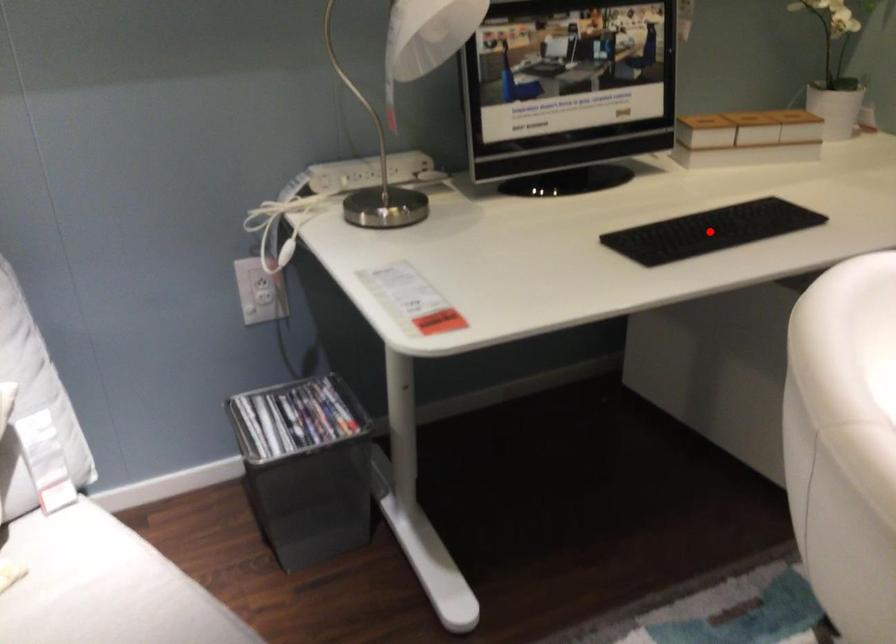
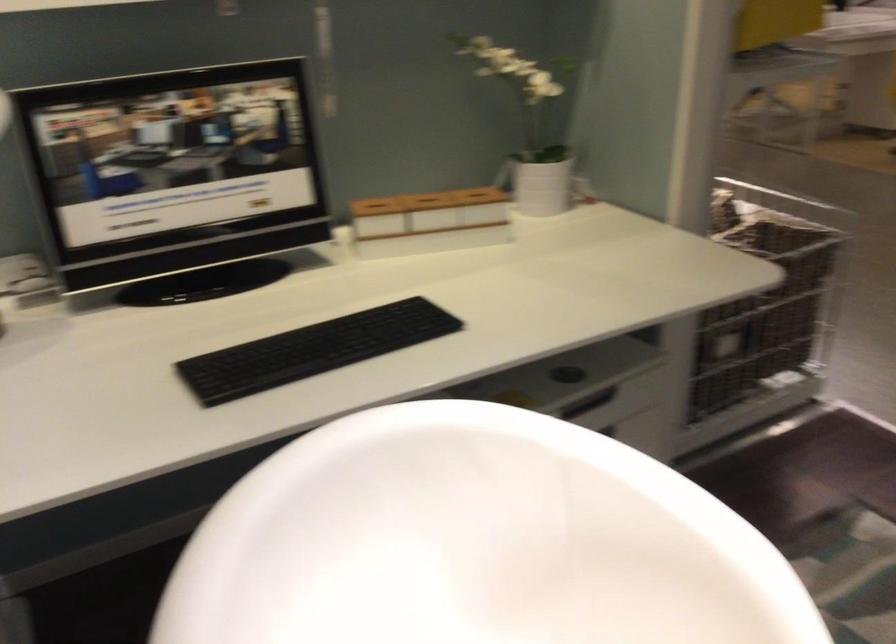
Question: I am providing you with two images of the same scene from different viewpoints. A red point is shown in image1. For the corresponding object point in image2, is it positioned nearer or farther from the camera?

Choices:
 (A) Nearer
 (B) Farther

Answer: (A)